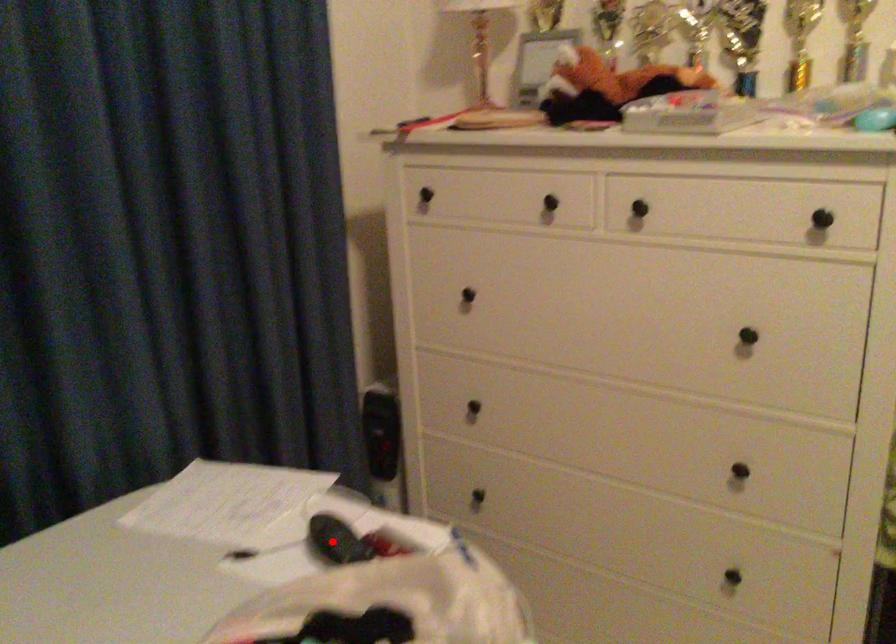
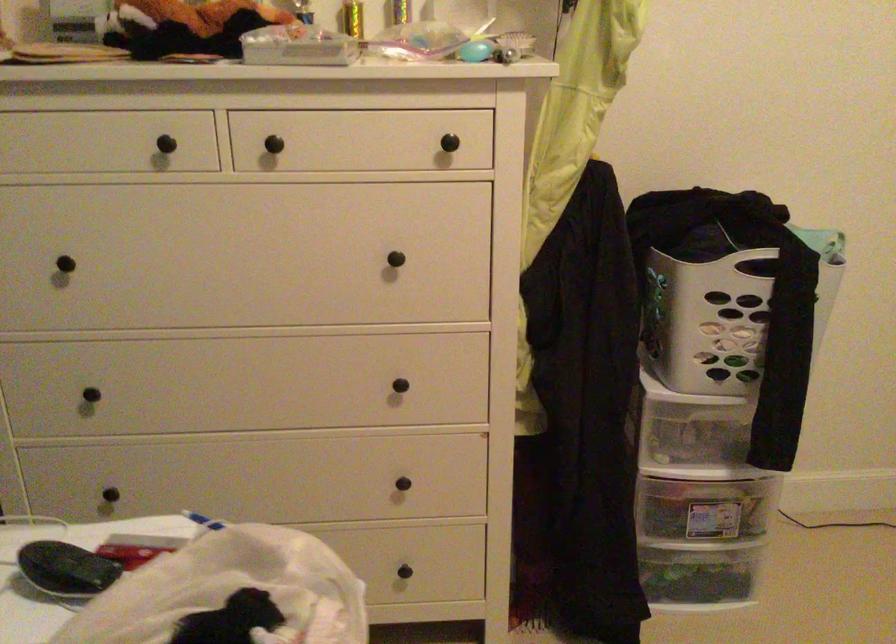
Where in the second image is the point corresponding to the highlighted location from the first image?

(65, 569)